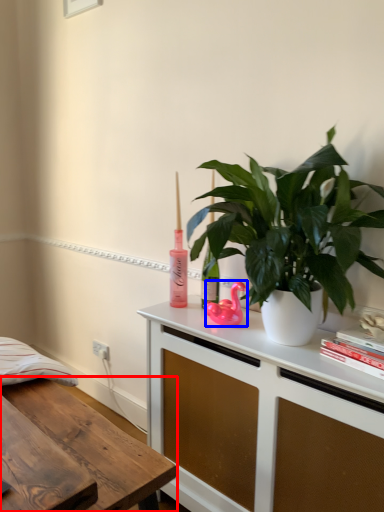
Question: Which object is further to the camera taking this photo, desk (highlighted by a red box) or appliance (highlighted by a blue box)?

Choices:
 (A) desk
 (B) appliance

Answer: (B)